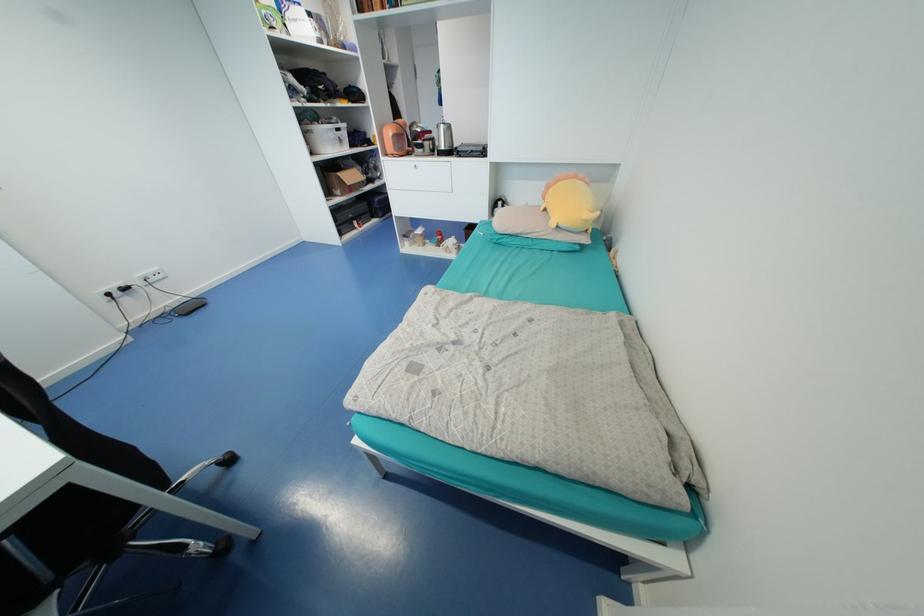
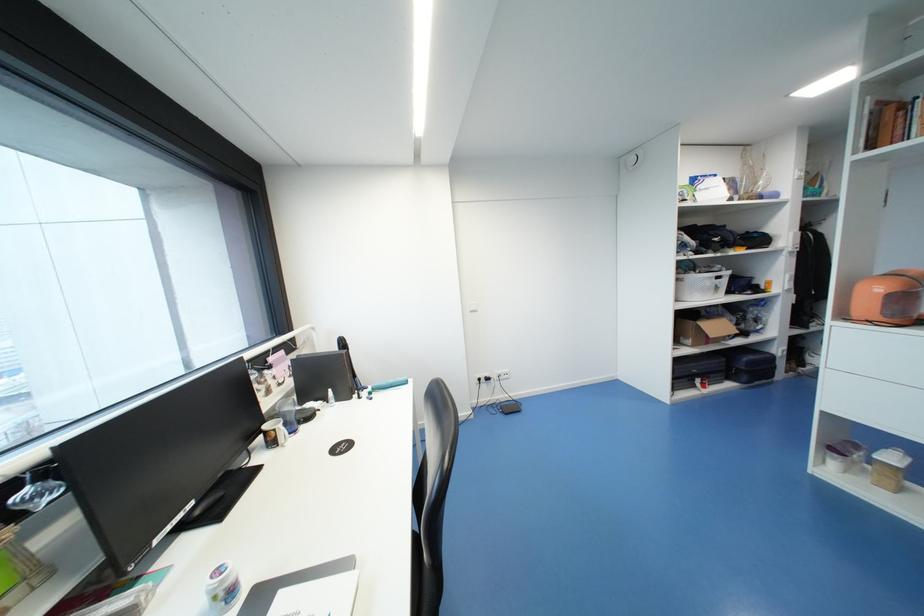
Question: The camera is either moving clockwise (left) or counter-clockwise (right) around the object. The first image is from the beginning of the video and the second image is from the end. Is the camera moving left or right when shooting the video?

Choices:
 (A) Left
 (B) Right

Answer: (B)